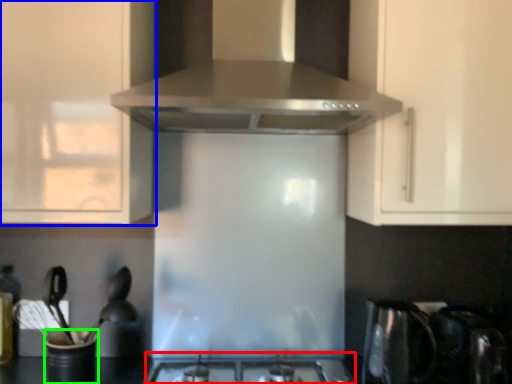
Question: Which is nearer to the gas stove (highlighted by a red box)? cabinetry (highlighted by a blue box) or appliance (highlighted by a green box).

Choices:
 (A) cabinetry
 (B) appliance

Answer: (B)